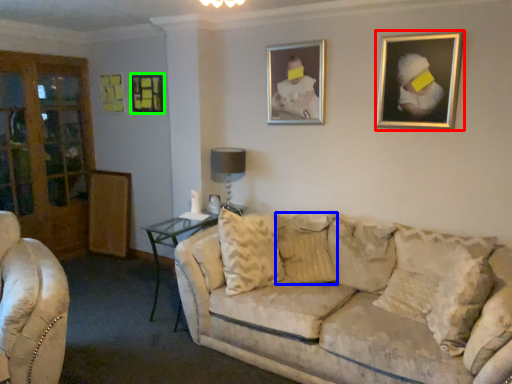
Question: Based on their relative distances, which object is farther from picture frame (highlighted by a red box)? Choose from pillow (highlighted by a blue box) and picture frame (highlighted by a green box).

Choices:
 (A) pillow
 (B) picture frame

Answer: (B)